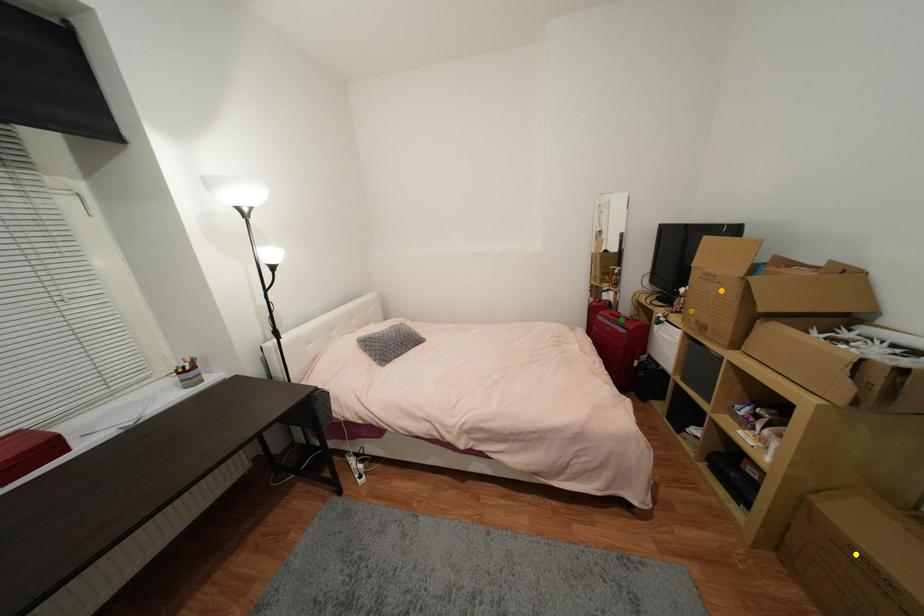
Order these from nearest to farthest:
orange point | green point | yellow point

yellow point → orange point → green point